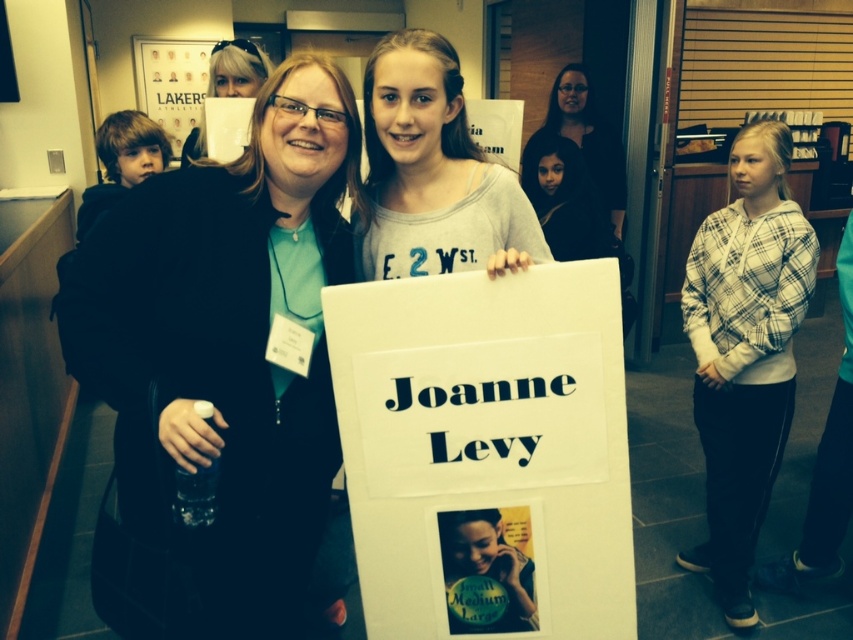
You are organizing a photo shoot and need to ensure that the matte black jacket at center and the gray cotton shirt at center are both visible in the final image. Based on their positions, which one should you focus on to ensure both are visible?

The matte black jacket at center is in front of the gray cotton shirt at center, so focusing on the matte black jacket at center will ensure both are visible as the gray cotton shirt at center is behind it.

You are a photographer at this event. You need to position yourself so that the distance between the white plaid hoodie at right and the matte black shirt at upper center in your photo is exactly 1.03 meters. Can you achieve this by standing at the current location?

Yes, because the white plaid hoodie at right is already 1.03 meters away from the matte black shirt at upper center, so positioning yourself here will maintain that distance in the photo.